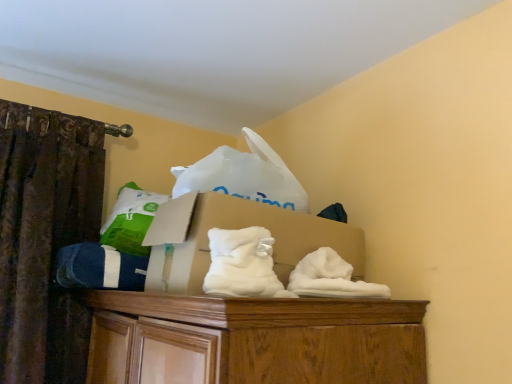
This screenshot has width=512, height=384. I want to click on cardboard box at center, so click(x=234, y=229).

What do you see at coordinates (99, 268) in the screenshot? I see `blue cotton socks at left` at bounding box center [99, 268].

The height and width of the screenshot is (384, 512). What are the coordinates of `cardboard box at center` in the screenshot? It's located at (234, 229).

Is blue cotton socks at left directly adjacent to cardboard box at center?

No, blue cotton socks at left is not in contact with cardboard box at center.

Based on their positions, is blue cotton socks at left located to the left or right of cardboard box at center?

blue cotton socks at left is positioned on cardboard box at center's left side.

Based on their sizes in the image, would you say blue cotton socks at left is bigger or smaller than cardboard box at center?

In the image, blue cotton socks at left appears to be smaller than cardboard box at center.

Which object is further away from the camera, blue cotton socks at left or cardboard box at center?

blue cotton socks at left.

Consider the image. Is white fluffy sheet at center located outside blue cotton socks at left?

Indeed, white fluffy sheet at center is completely outside blue cotton socks at left.

Find the location of a particular element. Image resolution: width=512 pixels, height=384 pixels. clothing on the left of the white fluffy sheet at center is located at coordinates (99, 268).

Looking at this image, from a real-world perspective, who is located lower, white fluffy sheet at center or blue cotton socks at left?

blue cotton socks at left, from a real-world perspective.

Which of these two, blue cotton socks at left or white fluffy sheet at center, stands taller?

Standing taller between the two is blue cotton socks at left.

Which is behind, blue cotton socks at left or white fluffy sheet at center?

blue cotton socks at left.

Looking at this image, is blue cotton socks at left looking in the opposite direction of white fluffy sheet at center?

No, blue cotton socks at left is not facing away from white fluffy sheet at center.

Does cardboard box at center have a greater height compared to white fluffy sheet at center?

Indeed, cardboard box at center has a greater height compared to white fluffy sheet at center.

Is cardboard box at center inside or outside of white fluffy sheet at center?

cardboard box at center is located beyond the bounds of white fluffy sheet at center.

Consider the image. From a real-world perspective, is cardboard box at center located beneath white fluffy sheet at center?

No, from a real-world perspective, cardboard box at center is not under white fluffy sheet at center.

In the scene shown: From a real-world perspective, who is located lower, cardboard box at center or blue cotton socks at left?

From a 3D spatial view, blue cotton socks at left is below.

From the image's perspective, is cardboard box at center above or below blue cotton socks at left?

Clearly, from the image's perspective, cardboard box at center is above blue cotton socks at left.

How many degrees apart are the facing directions of cardboard box at center and blue cotton socks at left?

The facing directions of cardboard box at center and blue cotton socks at left are 1.61 degrees apart.

Is cardboard box at center taller or shorter than blue cotton socks at left?

Considering their sizes, cardboard box at center has more height than blue cotton socks at left.

From the picture: Considering the sizes of objects white fluffy sheet at center and cardboard box at center in the image provided, who is taller, white fluffy sheet at center or cardboard box at center?

cardboard box at center is taller.

In the scene shown: Can you confirm if white fluffy sheet at center is thinner than cardboard box at center?

Indeed, white fluffy sheet at center has a lesser width compared to cardboard box at center.

Is white fluffy sheet at center aimed at cardboard box at center?

Yes, white fluffy sheet at center is oriented towards cardboard box at center.

Relative to cardboard box at center, is white fluffy sheet at center in front or behind?

Result: Clearly, white fluffy sheet at center is in front of cardboard box at center.

You are a GUI agent. You are given a task and a screenshot of the screen. Output one action in this format:
    pyautogui.click(x=<x>, y=<y>)
    Task: Click on the cardboard box that appears in front of the blue cotton socks at left
    This screenshot has width=512, height=384.
    Given the screenshot: What is the action you would take?
    [x=234, y=229]

At what (x,y) coordinates should I click in order to perform the action: click on sheet on the right of blue cotton socks at left. Please return your answer as a coordinate pair (x, y). This screenshot has height=384, width=512. Looking at the image, I should click on (243, 264).

When comparing their distances from blue cotton socks at left, does white fluffy sheet at center or cardboard box at center seem further?

Among the two, white fluffy sheet at center is located further to blue cotton socks at left.

From the image, which object appears to be farther from cardboard box at center, white fluffy sheet at center or blue cotton socks at left?

The object further to cardboard box at center is blue cotton socks at left.

Looking at the image, which one is located closer to cardboard box at center, blue cotton socks at left or white fluffy sheet at center?

The object closer to cardboard box at center is white fluffy sheet at center.

Which object lies nearer to the anchor point white fluffy sheet at center, cardboard box at center or blue cotton socks at left?

cardboard box at center is closer to white fluffy sheet at center.

Looking at the image, which one is located closer to white fluffy sheet at center, blue cotton socks at left or cardboard box at center?

cardboard box at center is closer to white fluffy sheet at center.

Considering their positions, is cardboard box at center positioned further to blue cotton socks at left than white fluffy sheet at center?

white fluffy sheet at center lies further to blue cotton socks at left than the other object.

Find the location of a particular element. sheet between blue cotton socks at left and cardboard box at center is located at coordinates pyautogui.click(x=243, y=264).